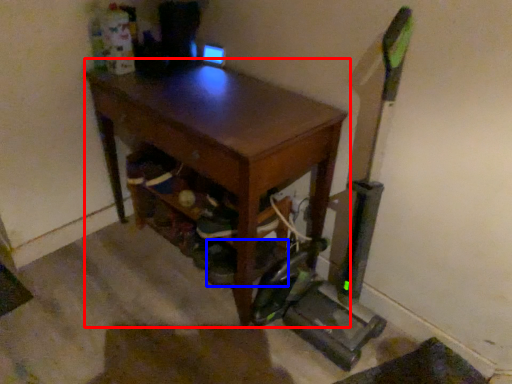
Question: Which of the following is the closest to the observer, desk (highlighted by a red box) or shoe (highlighted by a blue box)?

Choices:
 (A) desk
 (B) shoe

Answer: (A)